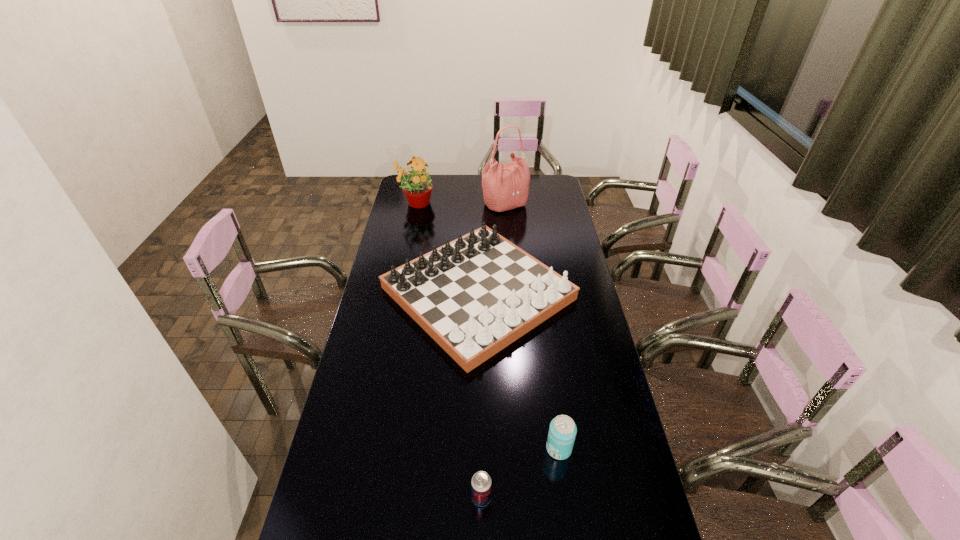
Find the location of a particular element. The image size is (960, 540). vacant space at the left edge of the desktop is located at coordinates (360, 470).

The image size is (960, 540). In the image, there is a desktop. Identify the location of vacant space at the right edge. (586, 466).

Where is `vacant region at the far left corner of the desktop`? vacant region at the far left corner of the desktop is located at coordinates (398, 196).

I want to click on free region at the far right corner, so click(540, 178).

In order to click on free spot between the farther beer can and the shorter beer can in this screenshot , I will do `click(520, 473)`.

The image size is (960, 540). I want to click on free point between the third tallest object and the shorter beer can, so click(x=480, y=395).

The height and width of the screenshot is (540, 960). In order to click on free point between the shorter beer can and the taller beer can in this screenshot , I will do `click(520, 473)`.

Locate an element on the screen. The image size is (960, 540). object that can be found as the third closest to the flowerpot is located at coordinates (562, 431).

Locate which object is the fourth closest to the right beer can. Please provide its 2D coordinates. Your answer should be formatted as a tuple, i.e. [(x, y)], where the tuple contains the x and y coordinates of a point satisfying the conditions above.

[(417, 187)]

You are a GUI agent. You are given a task and a screenshot of the screen. Output one action in this format:
    pyautogui.click(x=<x>, y=<y>)
    Task: Click on the blank space that satisfies the following two spatial constraints: 1. on the front side of the farther beer can; 2. on the left side of the tallest object
    Image resolution: width=960 pixels, height=540 pixels.
    Given the screenshot: What is the action you would take?
    pyautogui.click(x=524, y=449)